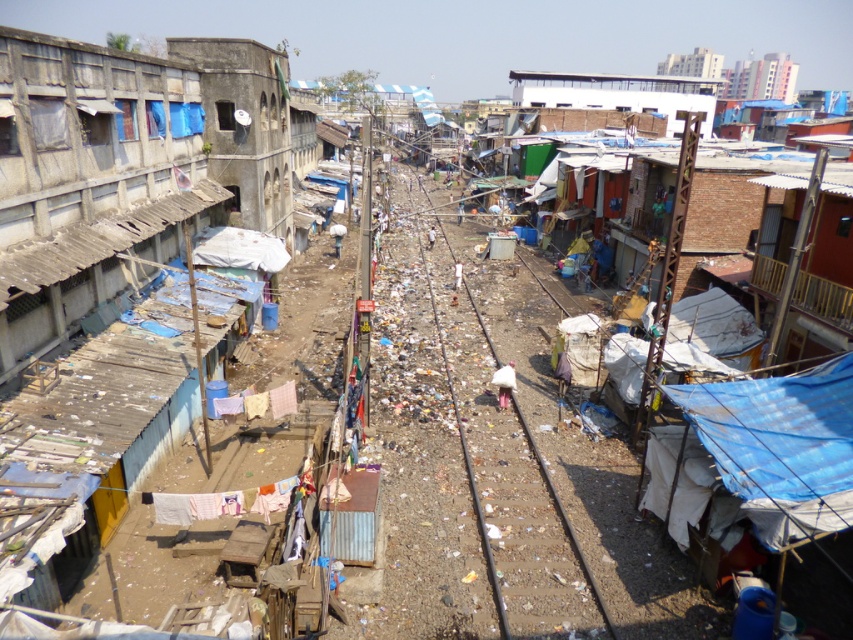
Question: Is rusty corrugated metal hut at left bigger than white corrugated metal hut at upper center?

Choices:
 (A) no
 (B) yes

Answer: (A)

Question: Is white corrugated metal hut at upper center further to camera compared to smooth metal train track at center?

Choices:
 (A) no
 (B) yes

Answer: (B)

Question: From the image, what is the correct spatial relationship of rusty corrugated metal hut at left in relation to white corrugated metal hut at upper center?

Choices:
 (A) left
 (B) right

Answer: (A)

Question: Estimate the real-world distances between objects in this image. Which object is closer to the rusty corrugated metal hut at left?

Choices:
 (A) smooth metal train track at center
 (B) white corrugated metal hut at upper center

Answer: (A)

Question: Which point appears farthest from the camera in this image?

Choices:
 (A) (105, 204)
 (B) (604, 74)
 (C) (514, 397)

Answer: (B)

Question: Which object appears closest to the camera in this image?

Choices:
 (A) rusty corrugated metal hut at left
 (B) smooth metal train track at center

Answer: (A)